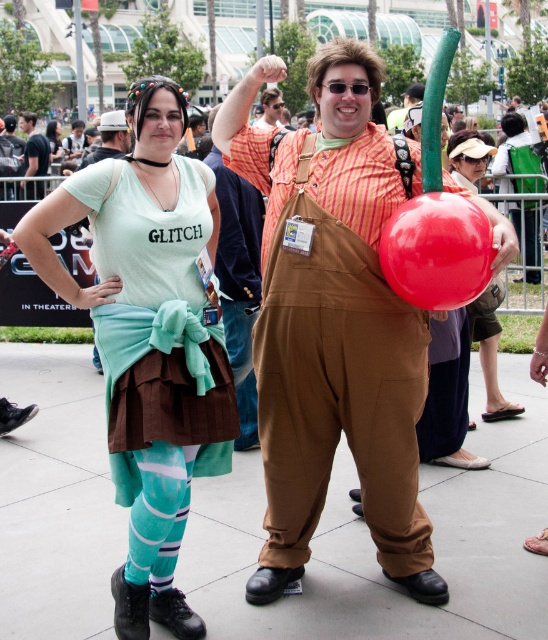
Can you confirm if matte green t-shirt at center is thinner than matte black laptop at left?

In fact, matte green t-shirt at center might be wider than matte black laptop at left.

Looking at this image, does matte green t-shirt at center lie behind matte black laptop at left?

No.

What do you see at coordinates (150, 340) in the screenshot? The width and height of the screenshot is (548, 640). I see `matte green t-shirt at center` at bounding box center [150, 340].

Image resolution: width=548 pixels, height=640 pixels. Identify the location of matte green t-shirt at center. (150, 340).

Is matte green t-shirt at center wider than matte red balloon at right?

Yes.

Is matte green t-shirt at center smaller than matte red balloon at right?

No.

Is point (155, 378) farther from camera compared to point (484, 166)?

No, (155, 378) is in front of (484, 166).

Find the location of a particular element. This screenshot has height=640, width=548. matte green t-shirt at center is located at coordinates (150, 340).

Can you confirm if matte black laptop at left is wider than matte green dress at center?

Incorrect, matte black laptop at left's width does not surpass matte green dress at center's.

Where is `matte black laptop at left`? The height and width of the screenshot is (640, 548). matte black laptop at left is located at coordinates (73, 140).